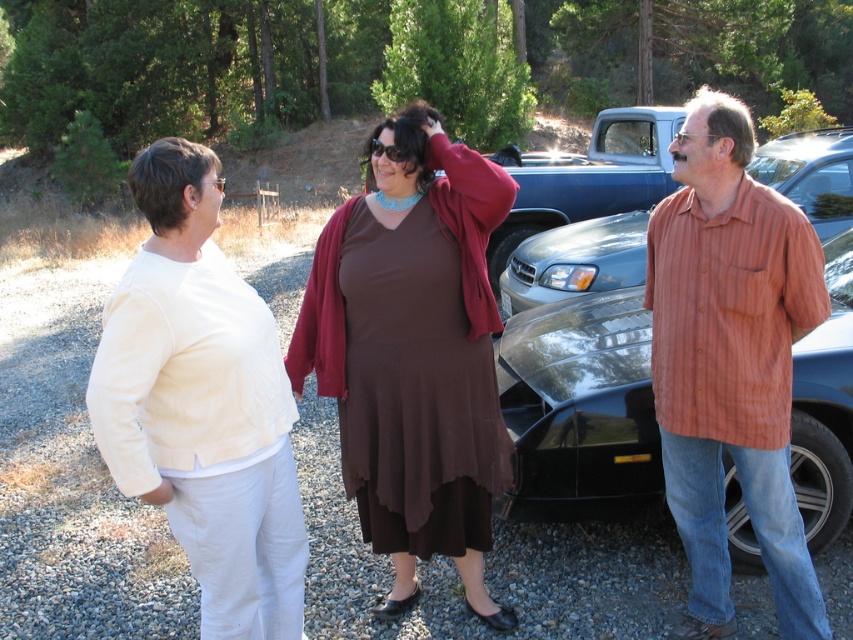
Question: Does brown matte dress at center come behind shiny metallic sedan at center?

Choices:
 (A) yes
 (B) no

Answer: (B)

Question: Estimate the real-world distances between objects in this image. Which object is closer to the black glossy car at center?

Choices:
 (A) matte white shirt at left
 (B) brown matte dress at center
 (C) striped cotton shirt at right

Answer: (B)

Question: Does brown matte dress at center have a greater width compared to black glossy car at center?

Choices:
 (A) no
 (B) yes

Answer: (A)

Question: Can you confirm if black glossy car at center is thinner than shiny metallic sedan at center?

Choices:
 (A) yes
 (B) no

Answer: (B)

Question: Which point appears closest to the camera in this image?

Choices:
 (A) (570, 353)
 (B) (316, 275)
 (C) (109, 404)
 (D) (553, 256)

Answer: (C)

Question: Which of the following is the farthest from the observer?

Choices:
 (A) pos(798,198)
 (B) pos(392,202)
 (C) pos(614,419)
 (D) pos(723,515)

Answer: (A)